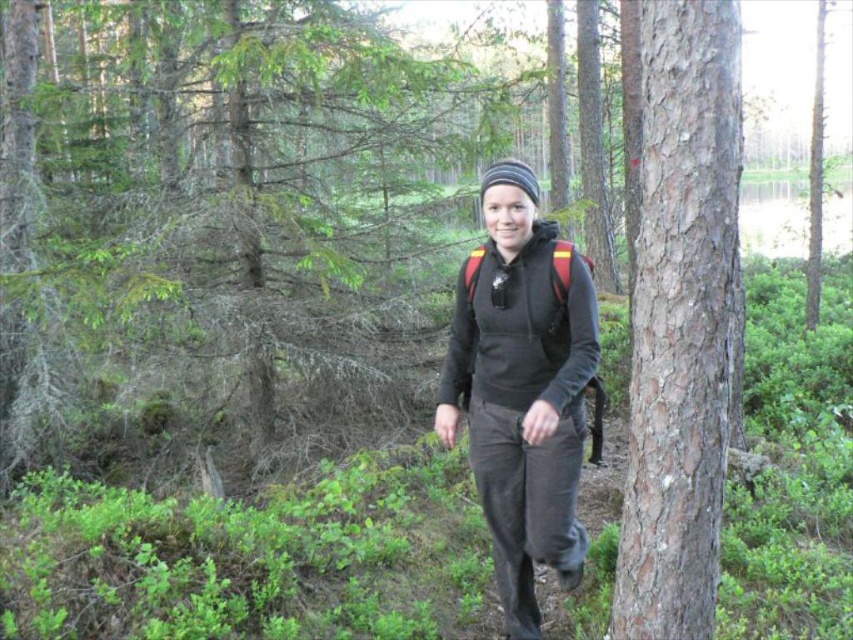
Question: Is smooth brown bark at center thinner than matte black hoodie at center?

Choices:
 (A) no
 (B) yes

Answer: (B)

Question: Which of the following is the farthest from the observer?

Choices:
 (A) (479, 460)
 (B) (659, 580)

Answer: (A)

Question: Does smooth brown bark at center have a larger size compared to matte black hoodie at center?

Choices:
 (A) no
 (B) yes

Answer: (A)

Question: Is smooth brown bark at center thinner than matte black hoodie at center?

Choices:
 (A) yes
 (B) no

Answer: (A)

Question: Which object appears farthest from the camera in this image?

Choices:
 (A) matte black hoodie at center
 (B) smooth brown bark at center

Answer: (A)

Question: Which point appears farthest from the camera in this image?

Choices:
 (A) (647, 362)
 (B) (595, 298)

Answer: (B)